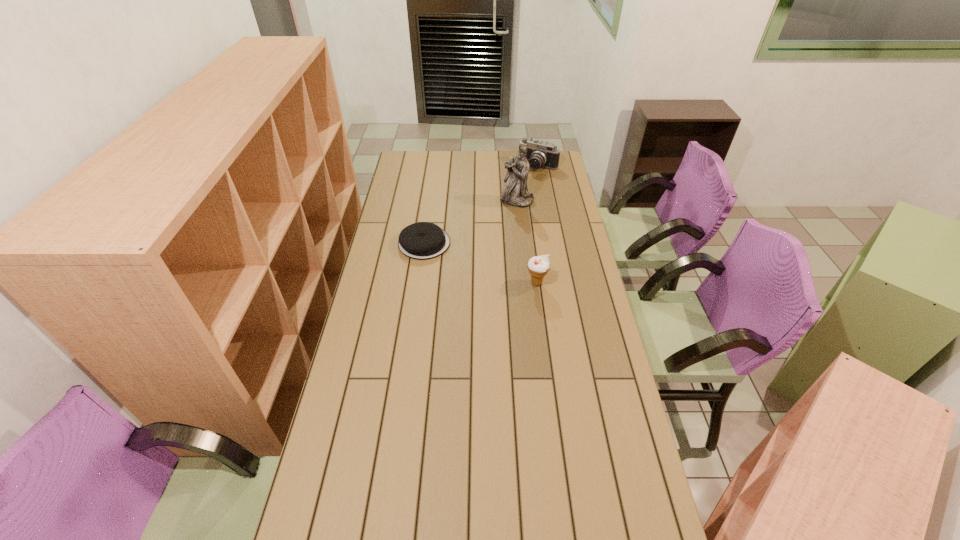
Find the location of a particular element. The width and height of the screenshot is (960, 540). vacant space that satisfies the following two spatial constraints: 1. on the front side of the icecream; 2. on the left side of the tallest object is located at coordinates (526, 283).